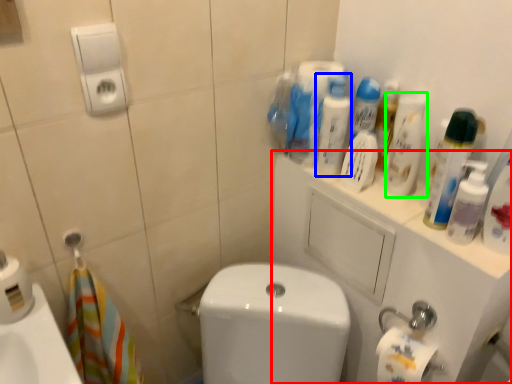
Question: Which object is the farthest from porcelain (highlighted by a red box)? Choose among these: cleaning product (highlighted by a blue box) or cleaning product (highlighted by a green box).

Choices:
 (A) cleaning product
 (B) cleaning product

Answer: (A)